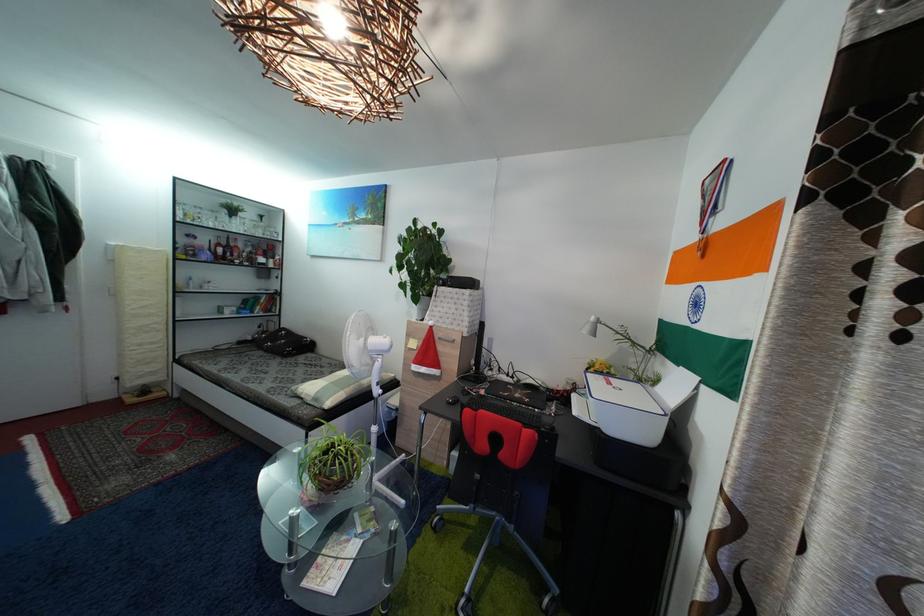
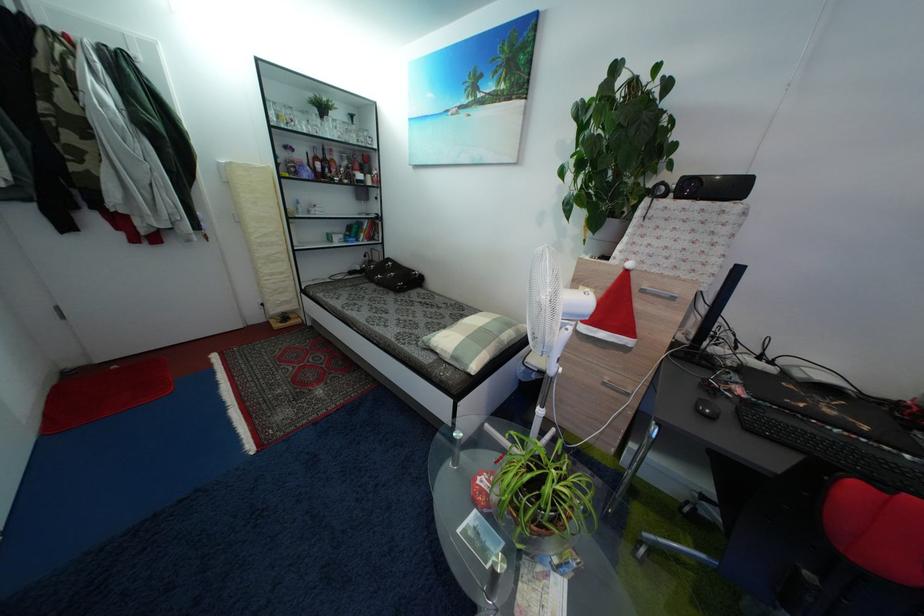
How did the camera likely rotate?

The rotation direction of the camera is left-down.